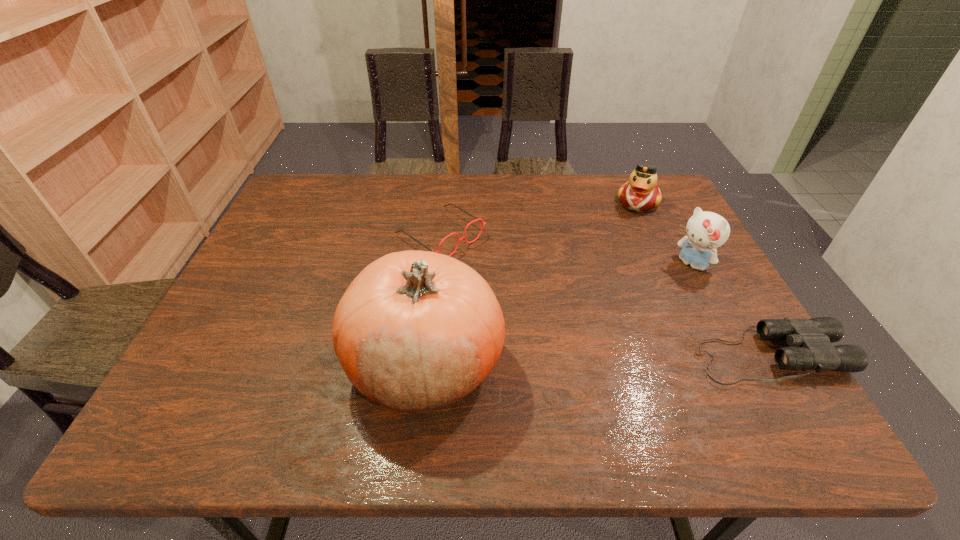
This screenshot has height=540, width=960. I want to click on kitten at the right edge, so click(706, 231).

Where is `duck positioned at the right edge`? This screenshot has width=960, height=540. duck positioned at the right edge is located at coordinates (641, 193).

Find the location of `object that is at the far right corner`. object that is at the far right corner is located at coordinates (641, 193).

Find the location of `object at the near right corner`. object at the near right corner is located at coordinates (811, 339).

Where is `blank space at the far edge of the desktop`? blank space at the far edge of the desktop is located at coordinates (477, 180).

What are the coordinates of `vacant space at the right edge of the desktop` in the screenshot? It's located at (682, 301).

Find the location of a particular element. Image resolution: width=960 pixels, height=540 pixels. vacant region at the far left corner of the desktop is located at coordinates (304, 174).

The image size is (960, 540). Find the location of `blank space at the near left corner of the desktop`. blank space at the near left corner of the desktop is located at coordinates (217, 392).

Where is `free space at the far right corner`? Image resolution: width=960 pixels, height=540 pixels. free space at the far right corner is located at coordinates (662, 208).

Locate an element on the screen. This screenshot has width=960, height=540. empty location between the duck and the fourth tallest object is located at coordinates (540, 219).